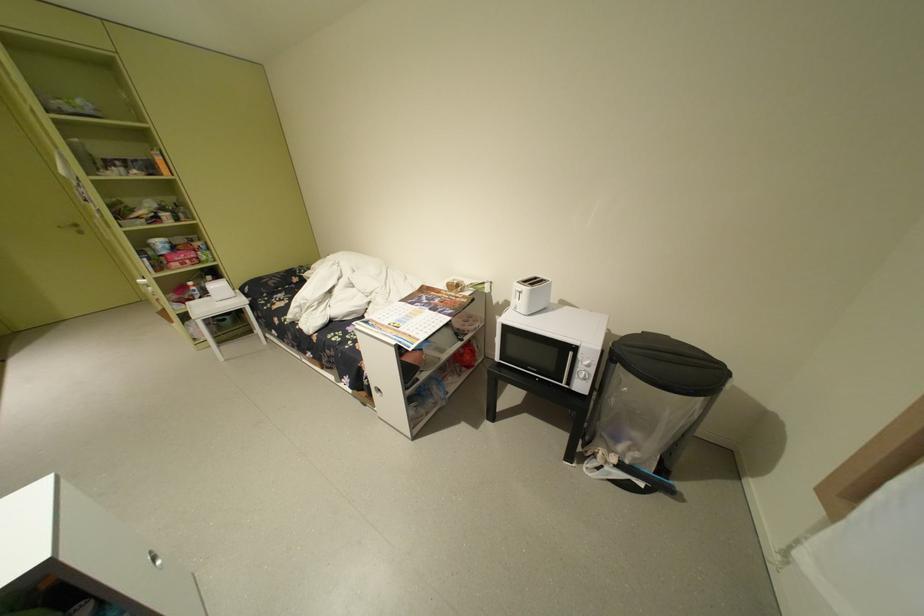
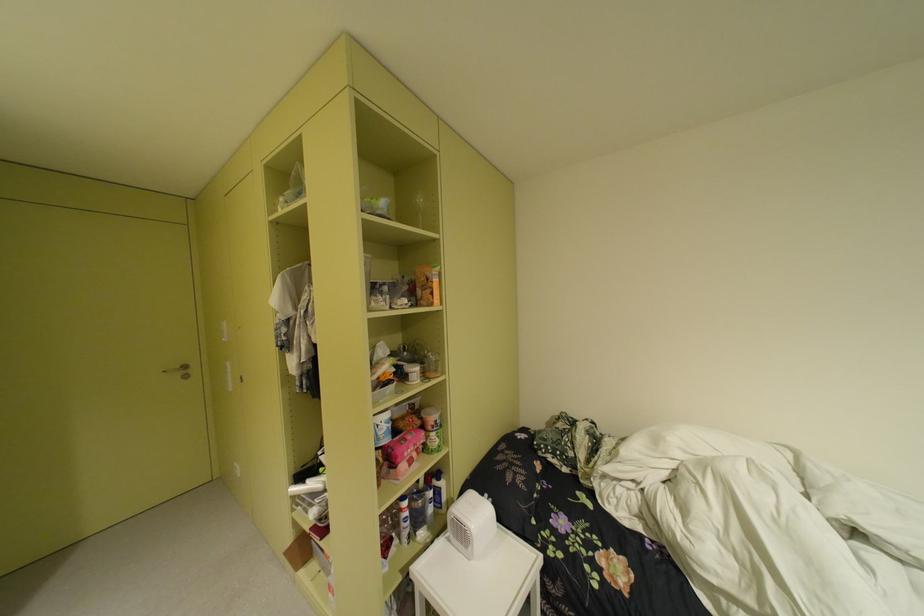
In the second image, find the point that corresponds to [147,172] in the first image.

(417, 301)